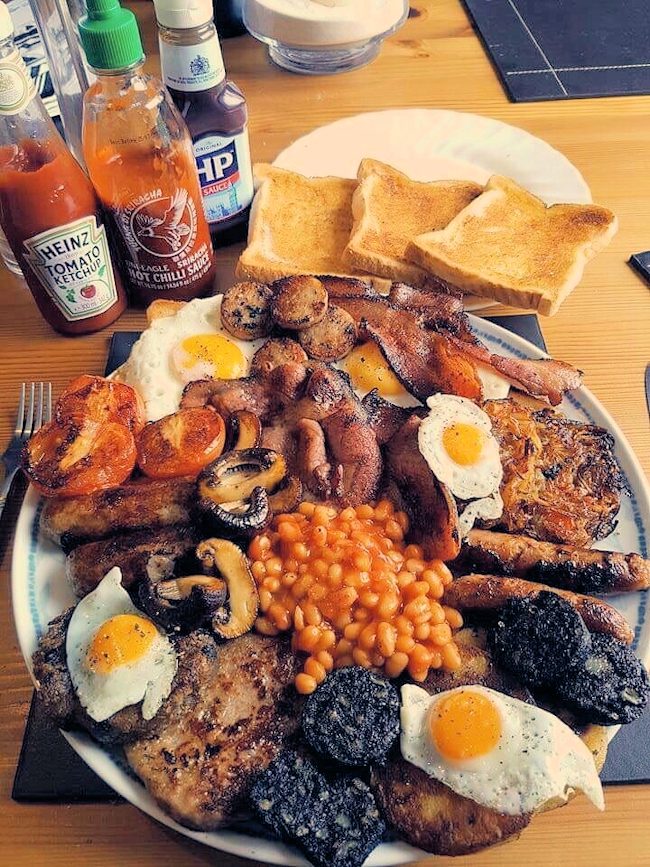
This screenshot has height=867, width=650. In order to click on table in this screenshot , I will do `click(424, 56)`.